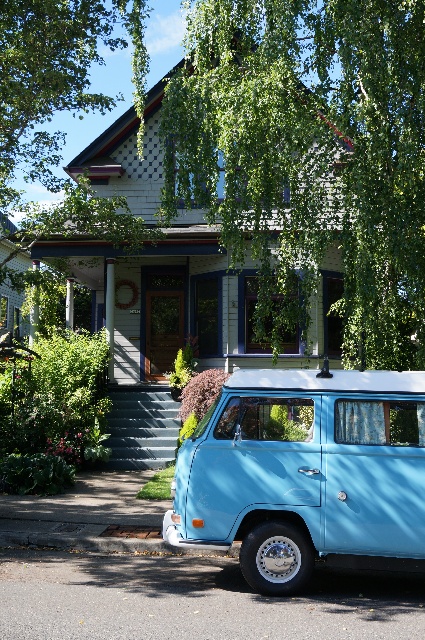
You are a delivery person with a cart that is 2 meters wide. You need to move from the light blue matte van at lower center to the smooth concrete steps at center. Is there enough space for your cart to pass through the area between them?

The distance between the light blue matte van at lower center and the smooth concrete steps at center is 7.14 meters. Since the cart is only 2 meters wide, there is sufficient space for the cart to pass through the area between them.

You are standing on the smooth concrete steps at center and want to reach the green leafy tree at upper center. Which direction should you move to get closer to the tree?

The green leafy tree at upper center is in front of the smooth concrete steps at center, so you should move forward towards the tree.

You are a pedestrian standing on the sidewalk and want to cross the street. The green leafy tree at upper center and the light blue matte van at lower center are in your line of sight. Which object is closer to you?

The green leafy tree at upper center is closer to you because the light blue matte van at lower center is positioned behind it.